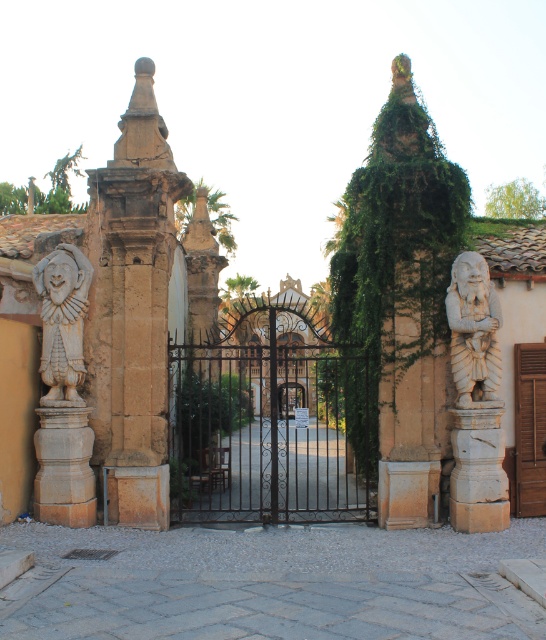
You are standing at the entrance of the gate and want to take a photo of both the stone clown at left and the white stone dwarf at right. Which statue should you focus on first to ensure both are in frame without moving the camera?

You should focus on the stone clown at left first since it is closer to the viewer than the white stone dwarf at right, allowing both to be captured in the frame without needing to adjust the camera position.

You are a delivery person approaching the entrance gate. You need to deliver a package to the house behind the gate. The gate is partially open, and you see the white stone dwarf at right and the brown wooden door at right. Which object is closer to the ground?

The white stone dwarf at right is shorter than the brown wooden door at right, so the white stone dwarf at right is closer to the ground.

You are a visitor approaching the grand entrance gate. You see the white stone dwarf at right and the brown wooden door at right. Which one is positioned to the left side of the other?

The white stone dwarf at right is positioned to the left of the brown wooden door at right.